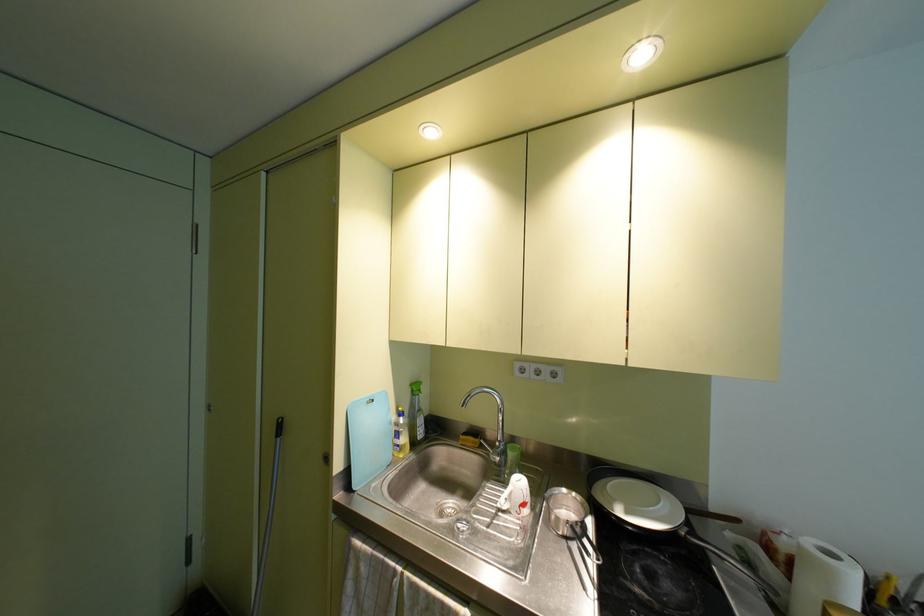
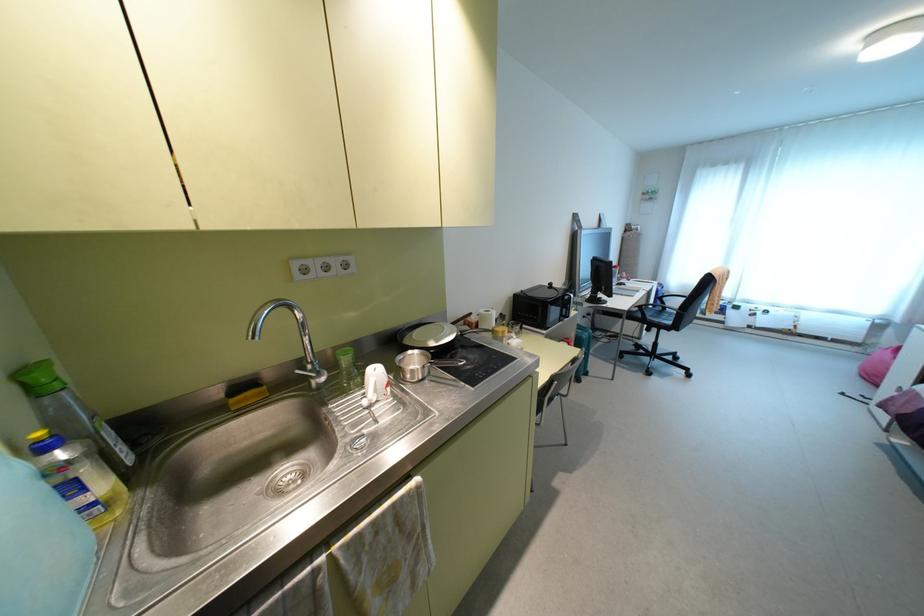
Where in the second image is the point corresponding to (399,413) from the first image?

(43, 447)